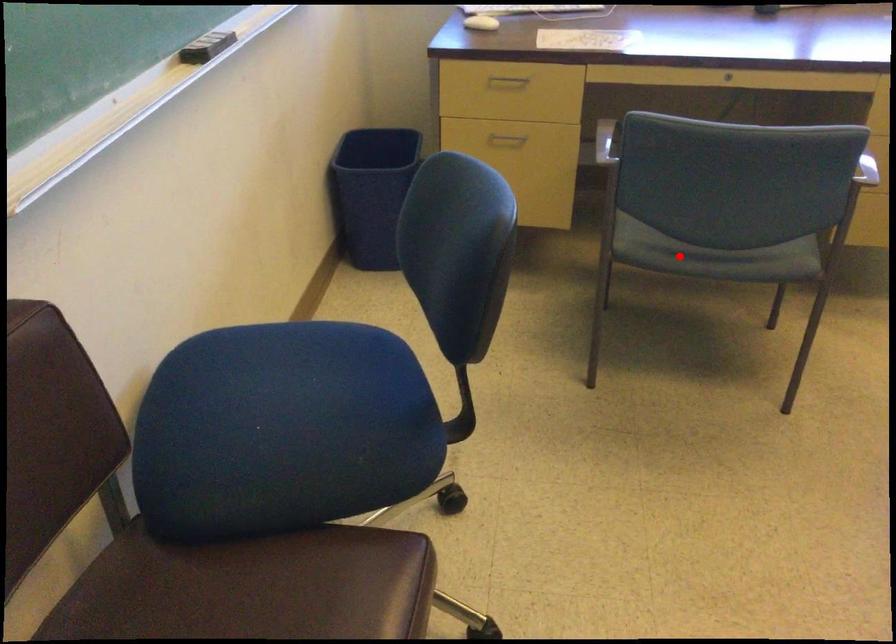
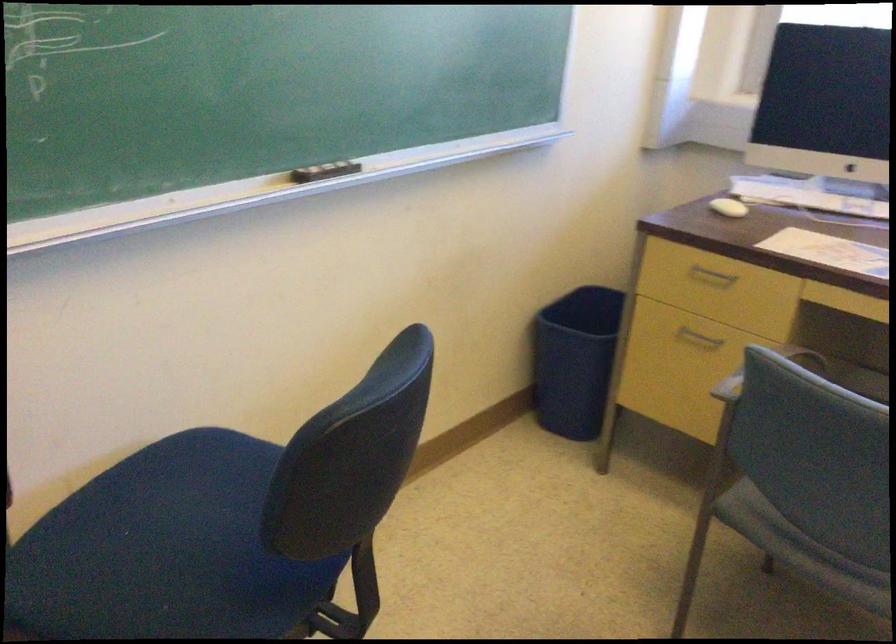
Where in the second image is the point corresponding to the highlighted location from the first image?

(800, 549)